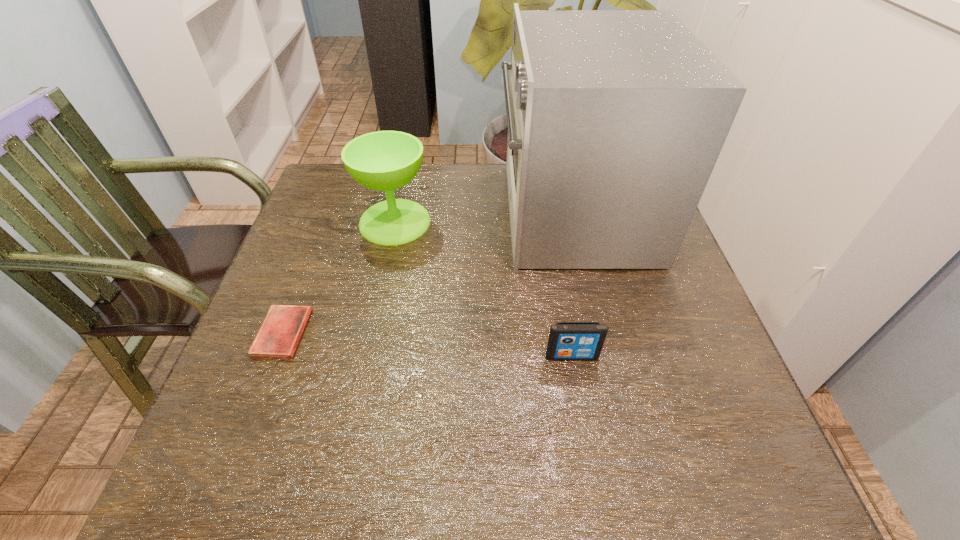
This screenshot has height=540, width=960. Identify the location of vacant space at the near edge of the desktop. (468, 481).

Identify the location of vacant space at the left edge of the desktop. This screenshot has height=540, width=960. (345, 285).

I want to click on vacant space at the right edge of the desktop, so click(x=680, y=289).

Identify the location of free space at the far left corner of the desktop. The image size is (960, 540). (353, 185).

At what (x,y) coordinates should I click in order to perform the action: click on free space between the third tallest object and the diary. Please return your answer as a coordinate pair (x, y). Looking at the image, I should click on (427, 345).

The image size is (960, 540). I want to click on free spot between the diary and the iPod, so click(x=427, y=345).

Where is `empty location between the tallest object and the second object from left to right`? empty location between the tallest object and the second object from left to right is located at coordinates (484, 218).

This screenshot has height=540, width=960. I want to click on free space between the third object from right to left and the iPod, so 483,289.

Find the location of a particular element. This screenshot has width=960, height=540. vacant space that is in between the third object from right to left and the third tallest object is located at coordinates (483, 289).

At what (x,y) coordinates should I click in order to perform the action: click on blank region between the second shortest object and the tallest object. Please return your answer as a coordinate pair (x, y). Looking at the image, I should click on (572, 285).